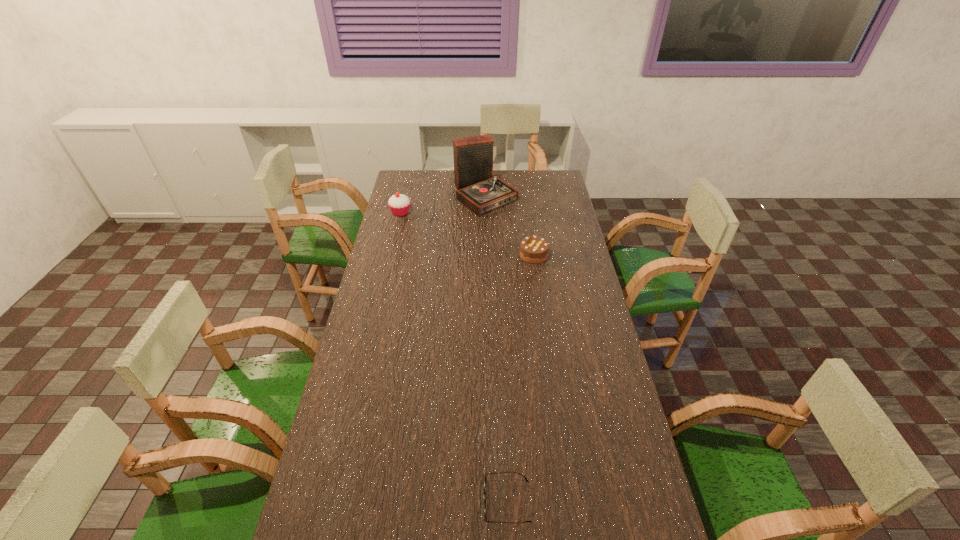
Identify the location of object that is the second closest to the phonograph record. (533, 249).

Find the location of a particular element. The image size is (960, 540). free space that satisfies the following two spatial constraints: 1. on the back side of the third shortest object; 2. on the right side of the phonograph record is located at coordinates (405, 195).

At what (x,y) coordinates should I click in order to perform the action: click on free location that satisfies the following two spatial constraints: 1. on the front side of the second shortest object; 2. on the left side of the tallest object. Please return your answer as a coordinate pair (x, y). This screenshot has height=540, width=960. Looking at the image, I should click on (486, 255).

Find the location of a particular element. The width and height of the screenshot is (960, 540). free space that satisfies the following two spatial constraints: 1. on the front side of the third shortest object; 2. on the right side of the chocolate cake is located at coordinates (x=391, y=255).

The height and width of the screenshot is (540, 960). I want to click on vacant space that satisfies the following two spatial constraints: 1. on the front side of the third shortest object; 2. on the left side of the second nearest object, so click(391, 255).